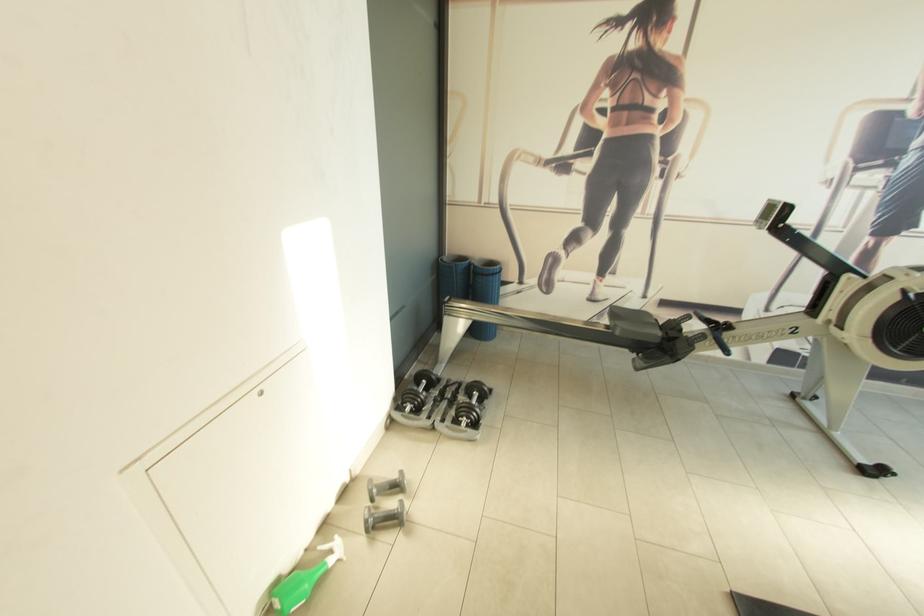
Find the location of a particular element. This screenshot has width=924, height=616. spray bottle trigger is located at coordinates (304, 580).